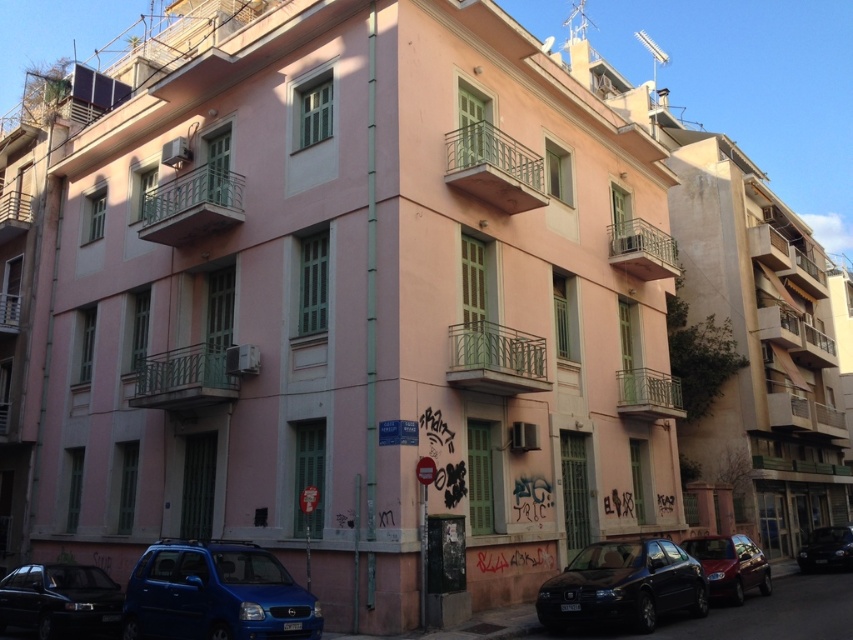
From the picture: Between shiny dark blue sedan at lower center and metallic green balcony at upper center, which one appears on the left side from the viewer's perspective?

metallic green balcony at upper center is more to the left.

Is shiny dark blue sedan at lower center smaller than metallic green balcony at upper center?

Actually, shiny dark blue sedan at lower center might be larger than metallic green balcony at upper center.

What do you see at coordinates (622, 586) in the screenshot?
I see `shiny dark blue sedan at lower center` at bounding box center [622, 586].

You are a GUI agent. You are given a task and a screenshot of the screen. Output one action in this format:
    pyautogui.click(x=<x>, y=<y>)
    Task: Click on the shiny dark blue sedan at lower center
    Image resolution: width=853 pixels, height=640 pixels.
    Given the screenshot: What is the action you would take?
    pyautogui.click(x=622, y=586)

In the scene shown: Can you confirm if green metal railing at center is smaller than shiny red car at lower right?

Indeed, green metal railing at center has a smaller size compared to shiny red car at lower right.

Does green metal railing at center have a lesser height compared to shiny red car at lower right?

No.

The image size is (853, 640). What are the coordinates of `green metal railing at center` in the screenshot? It's located at (496, 358).

This screenshot has width=853, height=640. What are the coordinates of `green metal railing at center` in the screenshot? It's located at (496, 358).

Who is more distant from viewer, [622,404] or [15,321]?

Point [15,321]

Which is more to the left, metallic silver balcony at center-right or green painted metal balcony at lower left?

From the viewer's perspective, green painted metal balcony at lower left appears more on the left side.

Based on the photo, who is more forward, (648, 400) or (10, 300)?

Point (648, 400) is in front.

Identify the location of metallic silver balcony at center-right. (648, 394).